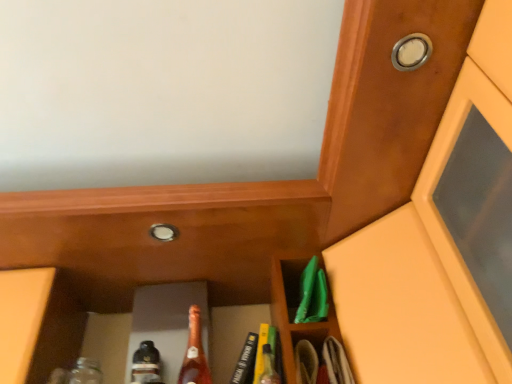
Where is `free location to the right of metallic silver knob at upper right, marked as the first knob in a top-to-bottom arrangement`? The image size is (512, 384). free location to the right of metallic silver knob at upper right, marked as the first knob in a top-to-bottom arrangement is located at coordinates (456, 52).